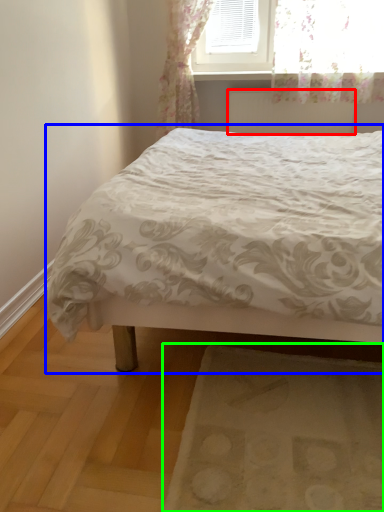
Question: Considering the real-world distances, which object is farthest from radiator (highlighted by a red box)? bed (highlighted by a blue box) or mat (highlighted by a green box)?

Choices:
 (A) bed
 (B) mat

Answer: (B)